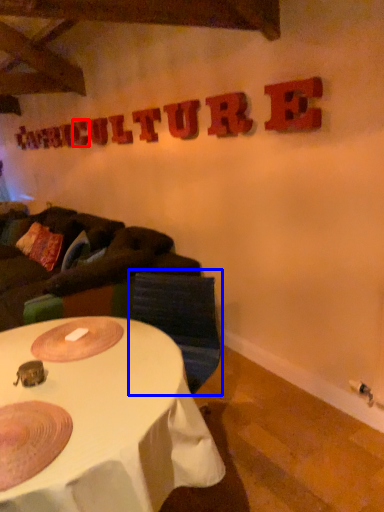
Question: Which point is closer to the camera, letter (highlighted by a red box) or swivel chair (highlighted by a blue box)?

Choices:
 (A) letter
 (B) swivel chair

Answer: (B)